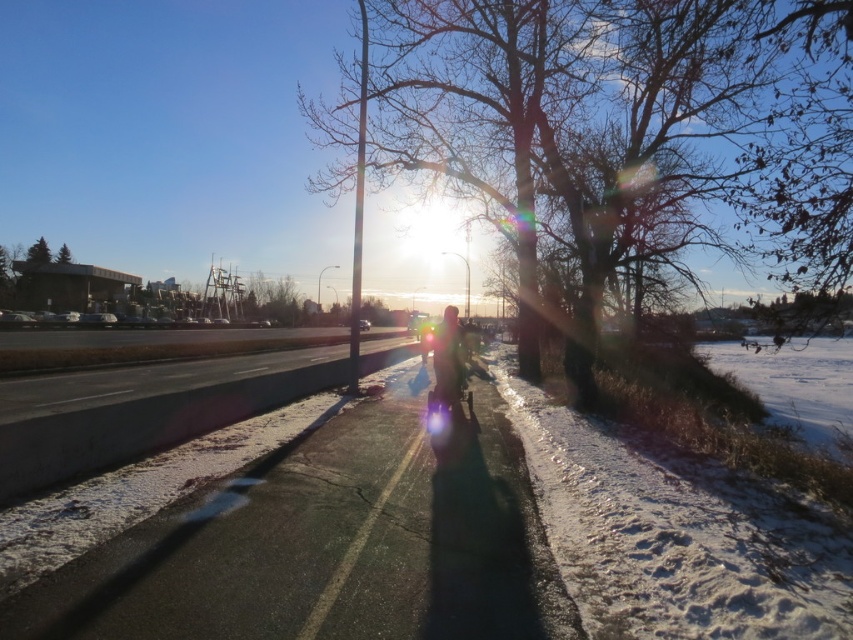
In the scene shown: Can you confirm if smooth asphalt road at center is smaller than matte black jacket at center?

Yes, smooth asphalt road at center is smaller than matte black jacket at center.

Does smooth asphalt road at center have a greater height compared to matte black jacket at center?

No.

I want to click on smooth asphalt road at center, so click(328, 545).

Identify the location of bare branches at center. (625, 122).

Is bare branches at center shorter than green textured pine tree at upper left?

No.

Does point (550, 45) lie in front of point (62, 246)?

Yes, point (550, 45) is closer to viewer.

Identify the location of bare branches at center. (625, 122).

Does matte black jacket at center come in front of green textured pine tree at upper left?

That is True.

Between point (465, 353) and point (61, 248), which one is positioned in front?

Point (465, 353) is more forward.

Where is `matte black jacket at center`? matte black jacket at center is located at coordinates (450, 364).